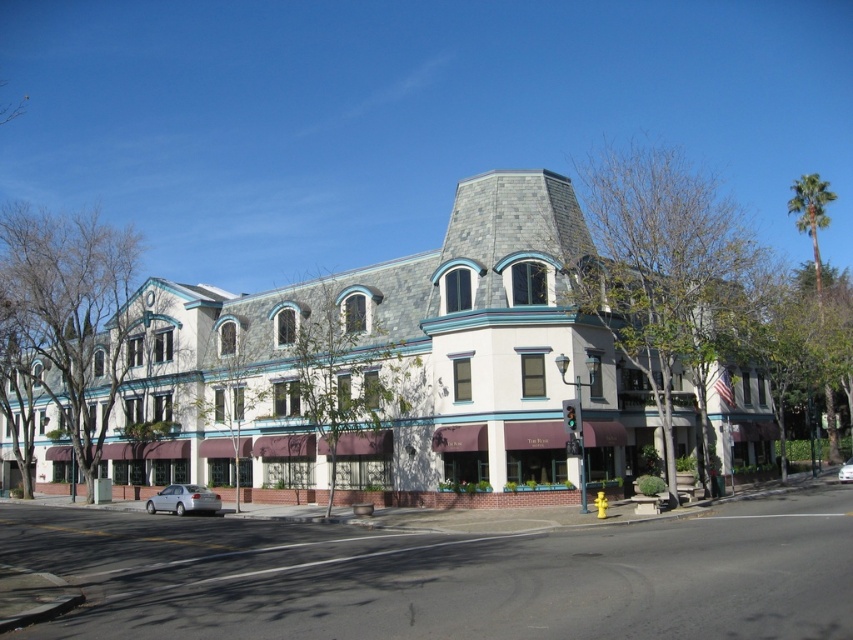
You are a delivery driver who needs to park your vehicle in the parking lot near the building. You see a silver metallic sedan at lower left and a silver metallic car at center. Which vehicle takes up less space in the parking spot?

The silver metallic sedan at lower left occupies less space than the silver metallic car at center, so it takes up less space in the parking spot.

You are a photographer planning to take a wide shot of the white stone building at center and the silver metallic car at center from across the street. Considering their sizes, which object should you focus on first to ensure both are in frame?

The white stone building at center is larger in size than the silver metallic car at center, so you should focus on the white stone building at center first to ensure both fit within the frame.